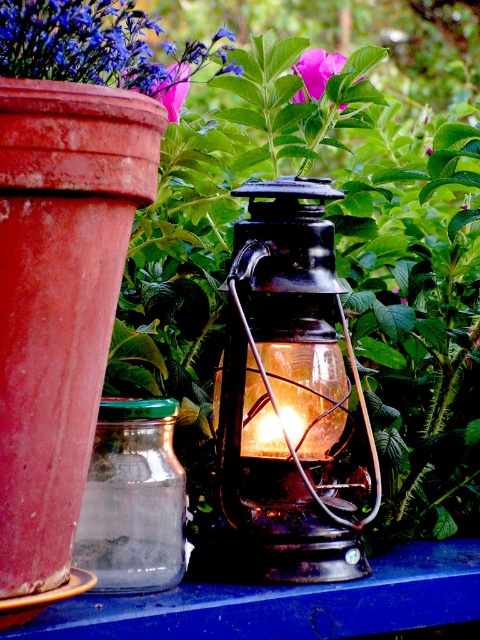
Between point (344, 547) and point (156, 577), which one is positioned behind?

The point (344, 547) is more distant.

Between matte black lantern at center and transparent glass jar at lower left, which one has less height?

transparent glass jar at lower left is shorter.

Where is `matte black lantern at center`? matte black lantern at center is located at coordinates (288, 392).

Where is `matte black lantern at center`? This screenshot has height=640, width=480. matte black lantern at center is located at coordinates (288, 392).

Between matte black lantern at center and purple matte flower at upper left, which one appears on the right side from the viewer's perspective?

From the viewer's perspective, matte black lantern at center appears more on the right side.

Who is taller, matte black lantern at center or purple matte flower at upper left?

Standing taller between the two is matte black lantern at center.

Which is behind, point (232, 508) or point (165, 77)?

Point (232, 508)

Where is `matte black lantern at center`? matte black lantern at center is located at coordinates (288, 392).

Who is shorter, pink matte flower at center or purple matte flower at upper left?

Standing shorter between the two is purple matte flower at upper left.

The image size is (480, 640). I want to click on pink matte flower at center, so click(x=317, y=68).

Identify the location of pink matte flower at center. The height and width of the screenshot is (640, 480). (317, 68).